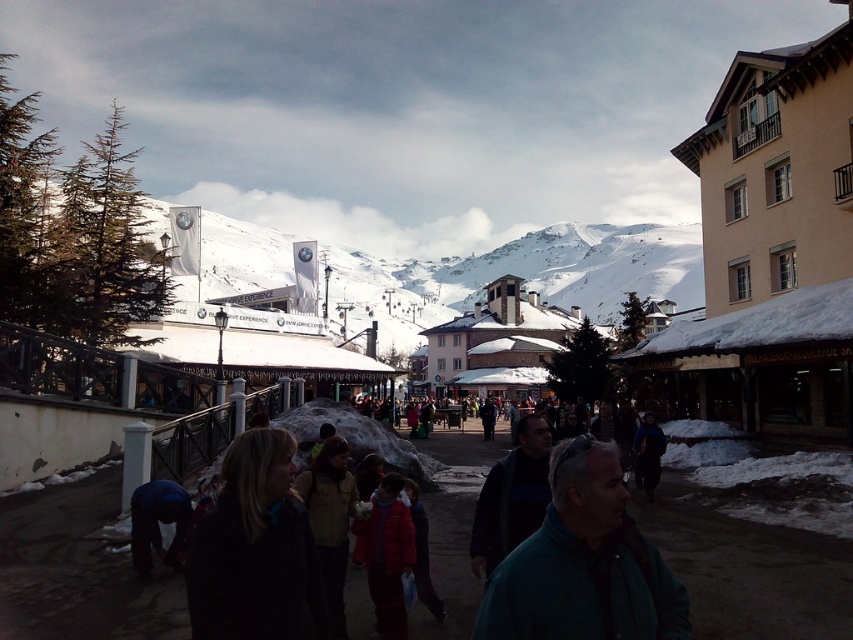
Question: Which object appears farthest from the camera in this image?

Choices:
 (A) green matte jacket at center
 (B) snowy white mountain at center
 (C) dark brown jacket at lower left

Answer: (B)

Question: From the image, what is the correct spatial relationship of dark brown jacket at lower left in relation to snowy white mountain at center?

Choices:
 (A) above
 (B) below

Answer: (B)

Question: Which point is closer to the camera?

Choices:
 (A) (582, 474)
 (B) (699, 236)

Answer: (A)

Question: Which point is closer to the camera?

Choices:
 (A) (607, 266)
 (B) (618, 452)

Answer: (B)

Question: Can you confirm if green matte jacket at center is wider than snowy white mountain at center?

Choices:
 (A) no
 (B) yes

Answer: (A)

Question: Is the position of green matte jacket at center more distant than that of dark brown jacket at lower left?

Choices:
 (A) no
 (B) yes

Answer: (A)